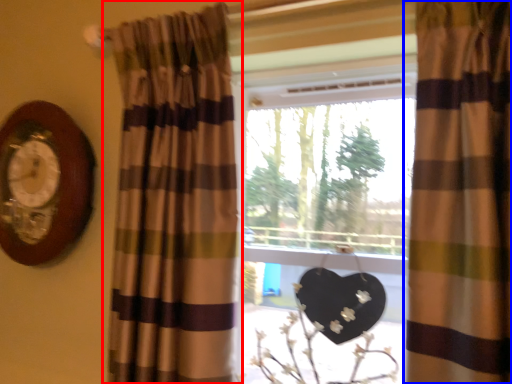
Question: Which object appears farthest to the camera in this image, curtain (highlighted by a red box) or curtain (highlighted by a blue box)?

Choices:
 (A) curtain
 (B) curtain

Answer: (A)